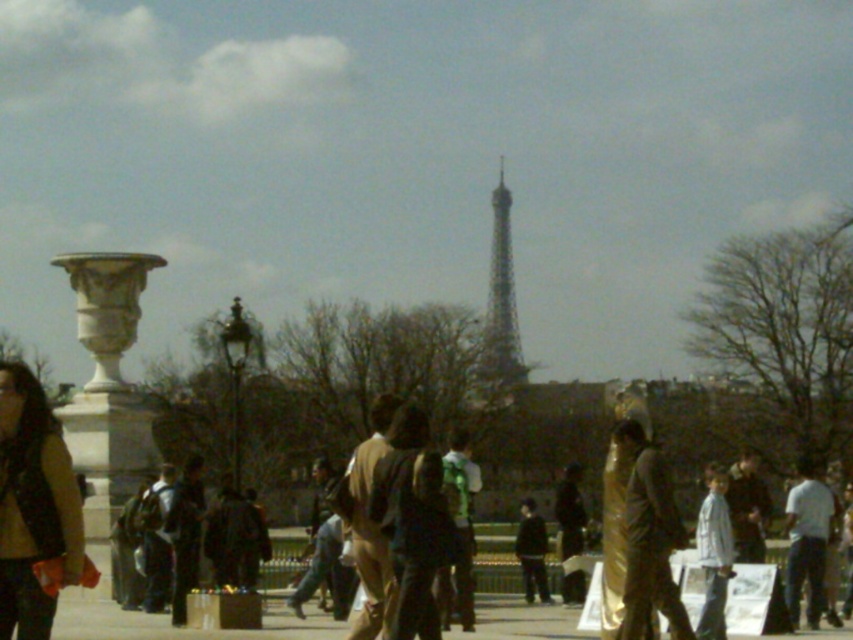
You are standing in the public square near the Eiffel Tower and notice a brown leather jacket at left. Can you determine its exact location based on the coordinates provided?

The brown leather jacket at left is located at point (x=35, y=509).

You are a photographer standing in the square and want to capture a photo of the metallic silver tower at center while avoiding the brown leather jacket at left from appearing in the shot. Is it possible to do so without moving the jacket?

The brown leather jacket at left is positioned under the metallic silver tower at center, meaning it is directly below the tower in the frame. By adjusting your camera angle to focus higher on the tower, you can exclude the jacket from the shot without moving it.